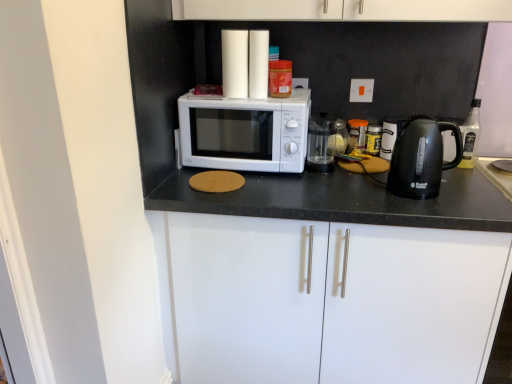
In order to click on vacant region to the right of transparent glass coffee maker at center in this screenshot , I will do `click(373, 168)`.